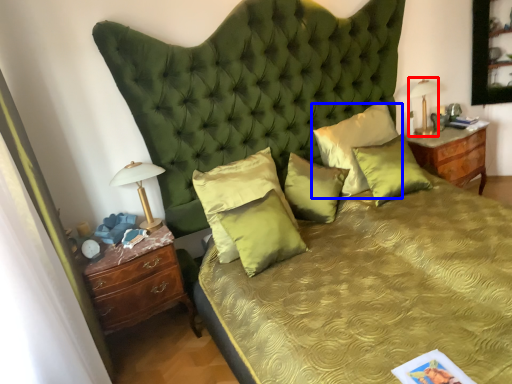
Question: Which of the following is the closest to the observer, bedside lamp (highlighted by a red box) or pillow (highlighted by a blue box)?

Choices:
 (A) bedside lamp
 (B) pillow

Answer: (B)